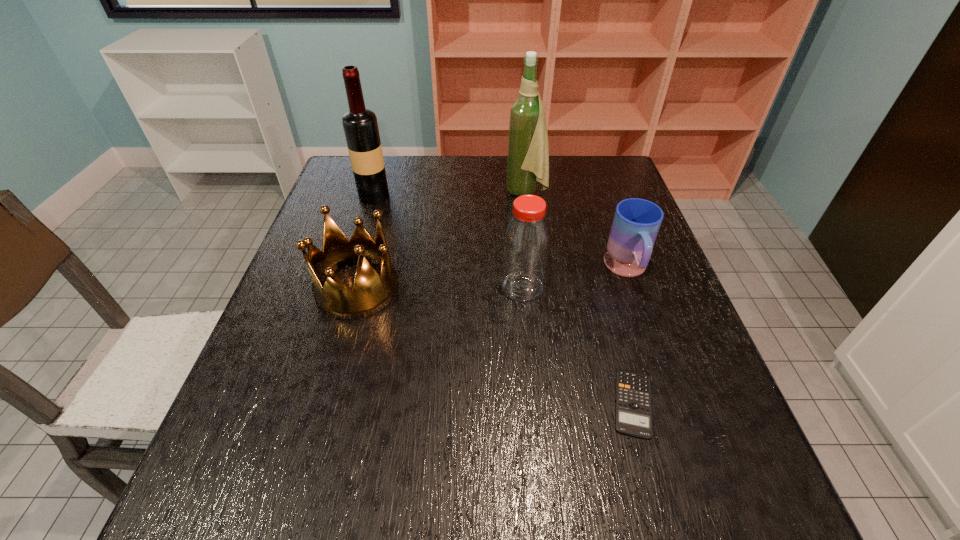
The width and height of the screenshot is (960, 540). In the image, there is a desktop. Find the location of `blank space at the far edge`. blank space at the far edge is located at coordinates (504, 191).

Locate an element on the screen. vacant space at the left edge of the desktop is located at coordinates (253, 429).

Locate an element on the screen. The height and width of the screenshot is (540, 960). vacant area at the right edge of the desktop is located at coordinates (677, 380).

The width and height of the screenshot is (960, 540). I want to click on free region at the far left corner of the desktop, so click(345, 161).

Where is `blank space at the far right corner`? The height and width of the screenshot is (540, 960). blank space at the far right corner is located at coordinates (632, 193).

Image resolution: width=960 pixels, height=540 pixels. Identify the location of vacant region between the right wine bottle and the crown. (442, 240).

The width and height of the screenshot is (960, 540). What are the coordinates of `free space that is in between the left wine bottle and the bottle` in the screenshot? It's located at (448, 241).

I want to click on free space between the second shortest object and the left wine bottle, so click(500, 233).

Where is `vacant point located between the fourth shortest object and the nearest object`? The image size is (960, 540). vacant point located between the fourth shortest object and the nearest object is located at coordinates point(578,345).

You are a GUI agent. You are given a task and a screenshot of the screen. Output one action in this format:
    pyautogui.click(x=<x>, y=<y>)
    Task: Click on the empty space between the crown and the mug
    This screenshot has width=960, height=540.
    Given the screenshot: What is the action you would take?
    pyautogui.click(x=492, y=279)